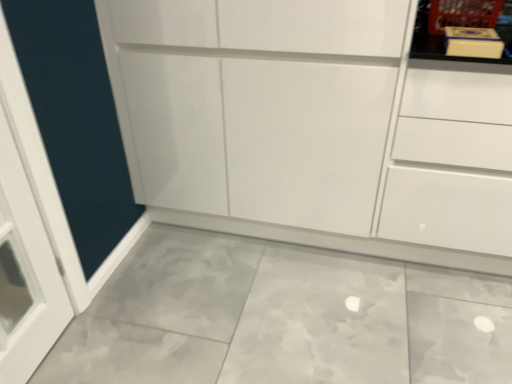
Question: Is matte yellow book at upper right in front of or behind white glossy cupboard at center in the image?

Choices:
 (A) behind
 (B) front

Answer: (A)

Question: From the image's perspective, is matte yellow book at upper right above or below white glossy cupboard at center?

Choices:
 (A) below
 (B) above

Answer: (B)

Question: Which is farther from the white glossy drawer at upper right?

Choices:
 (A) matte yellow book at upper right
 (B) white glossy cupboard at center

Answer: (A)

Question: Estimate the real-world distances between objects in this image. Which object is closer to the matte yellow book at upper right?

Choices:
 (A) white glossy drawer at upper right
 (B) white glossy cupboard at center

Answer: (A)